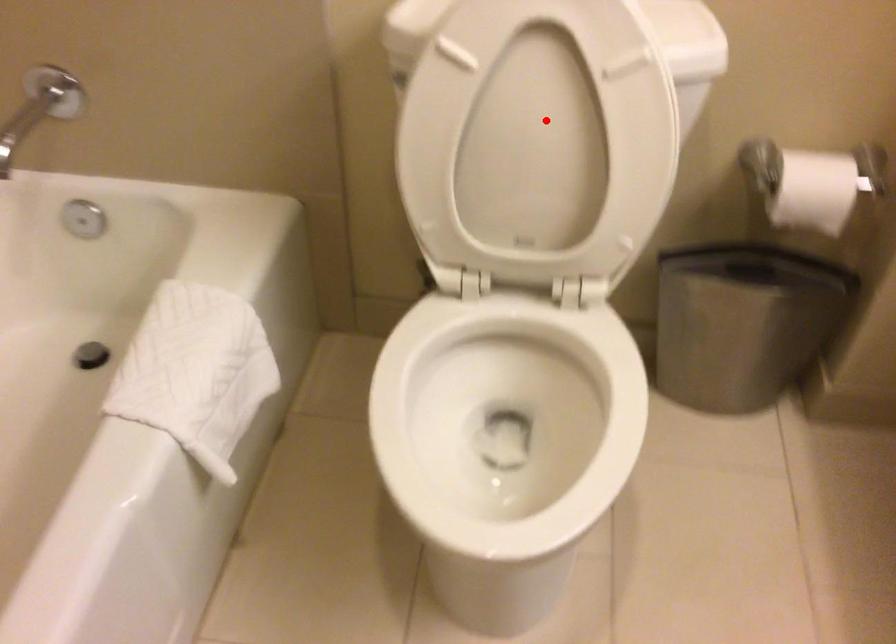
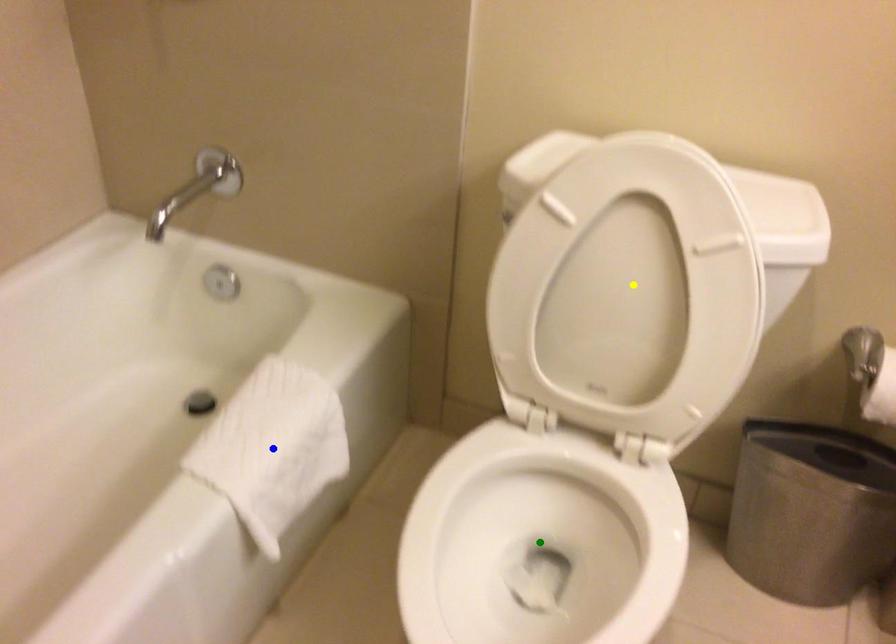
Question: I am providing you with two images of the same scene from different viewpoints. A red point is marked on the first image. You are given multiple points on the second image. In image 2, which mark is for the same physical point as the one in image 1?

Choices:
 (A) yellow point
 (B) green point
 (C) blue point

Answer: (A)